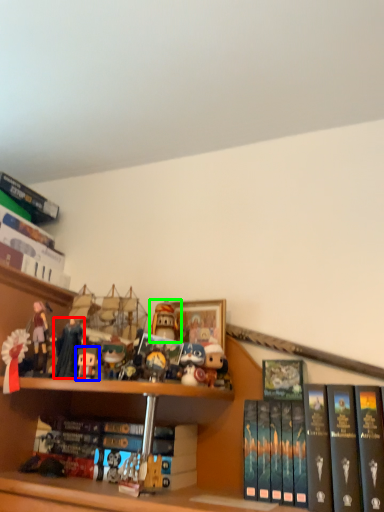
Question: Considering the real-world distances, which object is closest to toy (highlighted by a red box)? toy (highlighted by a blue box) or toy (highlighted by a green box).

Choices:
 (A) toy
 (B) toy

Answer: (A)